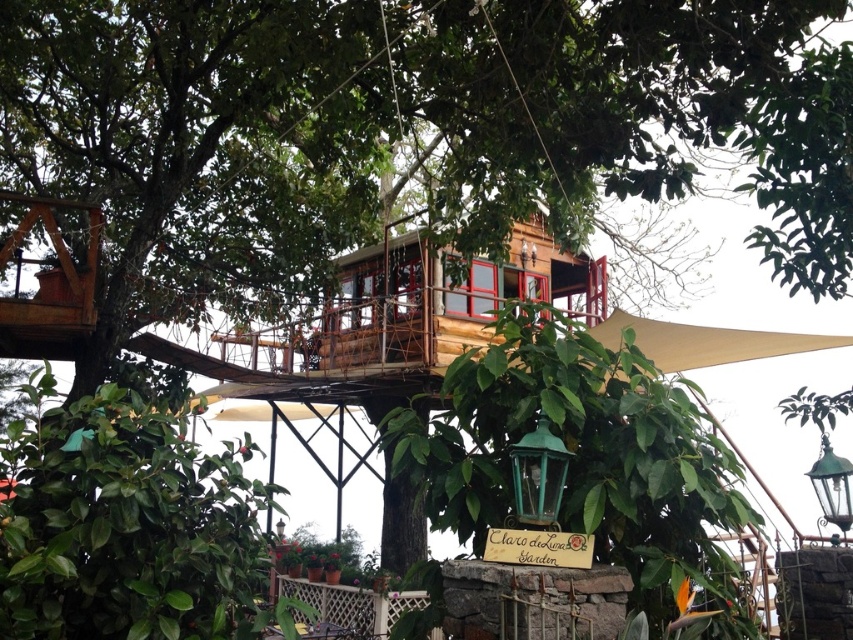
Question: Which point is farther to the camera?

Choices:
 (A) (171, 70)
 (B) (662, 332)

Answer: (B)

Question: Is wooden treehouse at center positioned in front of beige fabric canopy at lower right?

Choices:
 (A) no
 (B) yes

Answer: (A)

Question: Considering the relative positions of wooden treehouse at center and beige fabric canopy at lower right in the image provided, where is wooden treehouse at center located with respect to beige fabric canopy at lower right?

Choices:
 (A) below
 (B) above

Answer: (B)

Question: Does wooden treehouse at center appear on the right side of beige fabric canopy at lower right?

Choices:
 (A) no
 (B) yes

Answer: (A)